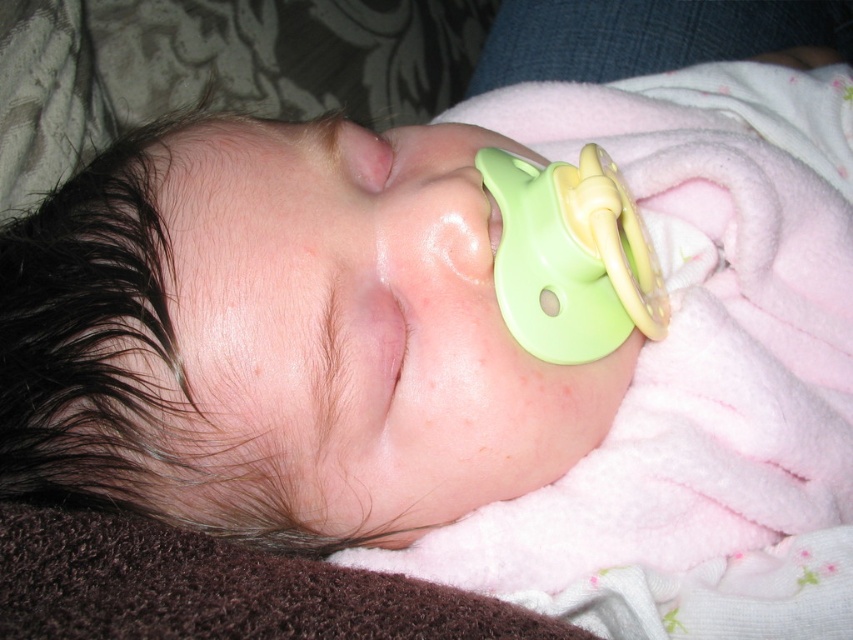
You are a photographer adjusting the focus on a camera lens. You need to focus on two points in the image of the sleeping baby. The first point is at coordinates point (595, 508) and the second point is at coordinates point (579, 339). Which point should you focus on first to ensure the closest object is sharp?

Point (595, 508) is closer to the viewer than point (579, 339), so you should focus on point (595, 508) first to ensure the closest object is sharp.

You are a caregiver checking on a sleeping baby. You notice the pink fleece blanket at center and the smooth skin at center. Which object covers more area in the image?

The pink fleece blanket at center is larger in size than smooth skin at center, so the pink fleece blanket at center covers more area in the image.